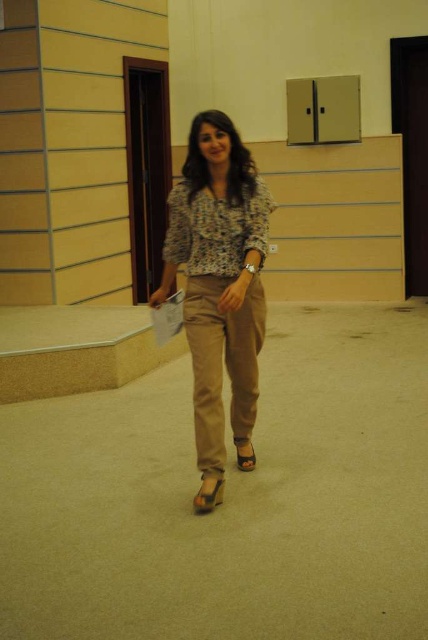
You are an interior designer assessing the lighting in a room. You notice the matte floral blouse at center and the shiny gold sandal at center. Which object would reflect more light, and why?

The shiny gold sandal at center would reflect more light because it has a reflective surface, while the matte floral blouse at center has a nonreflective finish.

You are an interior designer observing the scene. You need to place a decorative item between the matte floral blouse at center and the shiny gold sandal at center. Based on their positions, which object should the decorative item be closer to?

The decorative item should be placed closer to the shiny gold sandal at center because the matte floral blouse at center is positioned on the left side of it.